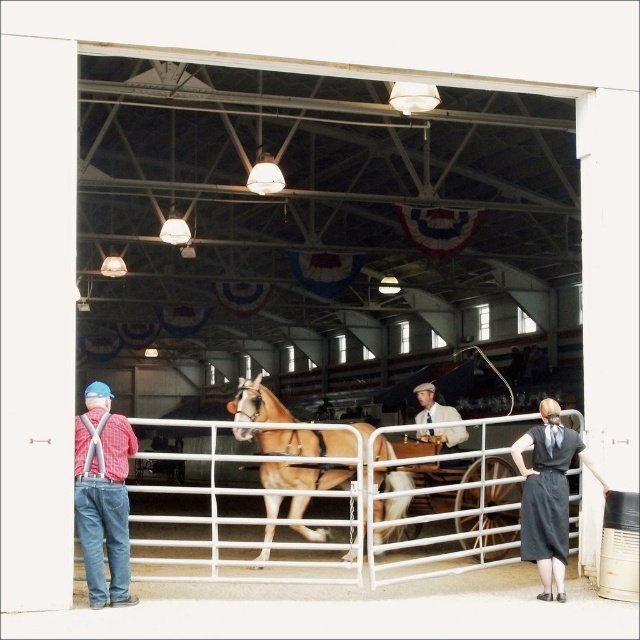
Question: Which point is farther from the camera taking this photo?

Choices:
 (A) (548, 492)
 (B) (460, 436)
 (C) (323, 476)

Answer: (B)

Question: Does light brown leather horse at center appear on the left side of red plaid shirt at left?

Choices:
 (A) no
 (B) yes

Answer: (A)

Question: Among these objects, which one is nearest to the camera?

Choices:
 (A) red plaid shirt at left
 (B) light brown leather horse at center
 (C) white metal fence at center

Answer: (C)

Question: Does white metal fence at center appear on the right side of light brown leather jacket at center?

Choices:
 (A) yes
 (B) no

Answer: (B)

Question: Which object appears farthest from the camera in this image?

Choices:
 (A) white metal fence at center
 (B) red plaid shirt at left
 (C) light brown leather jacket at center
 (D) light brown leather horse at center

Answer: (C)

Question: Can you confirm if white metal fence at center is positioned below light brown leather jacket at center?

Choices:
 (A) yes
 (B) no

Answer: (A)